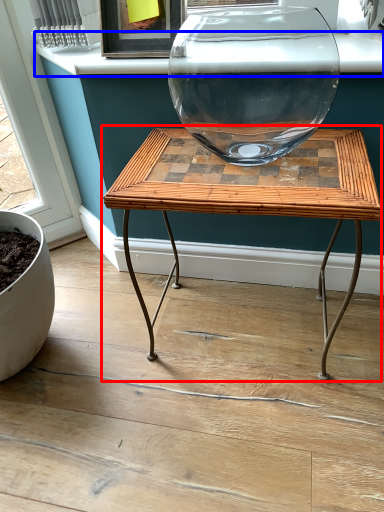
Question: Which of the following is the closest to the observer, table (highlighted by a red box) or window sill (highlighted by a blue box)?

Choices:
 (A) table
 (B) window sill

Answer: (A)